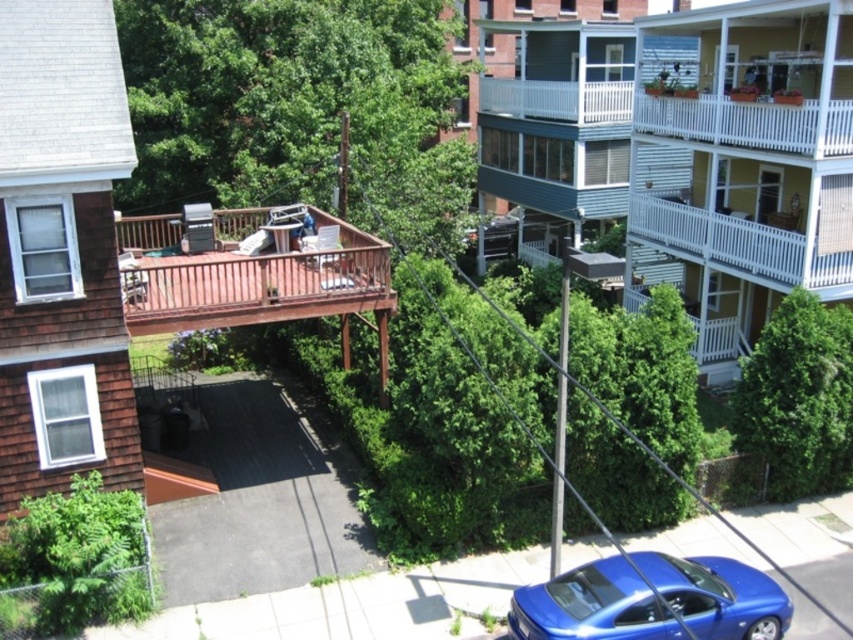
Question: Which point appears farthest from the camera in this image?

Choices:
 (A) (840, 358)
 (B) (631, 589)

Answer: (A)

Question: Which object appears closest to the camera in this image?

Choices:
 (A) shiny blue car at lower right
 (B) smooth concrete deck at center
 (C) green leafy tree at center-right

Answer: (A)

Question: Is green leafy tree at center to the left of green leafy tree at center-right from the viewer's perspective?

Choices:
 (A) yes
 (B) no

Answer: (A)

Question: From the image, what is the correct spatial relationship of green leafy tree at center in relation to green leafy tree at center-right?

Choices:
 (A) right
 (B) left

Answer: (B)

Question: Which of these objects is positioned closest to the green leafy tree at center-right?

Choices:
 (A) shiny blue car at lower right
 (B) smooth concrete deck at center
 (C) green leafy tree at center

Answer: (A)

Question: Where is green leafy tree at center located in relation to green leafy tree at center-right in the image?

Choices:
 (A) above
 (B) below

Answer: (A)